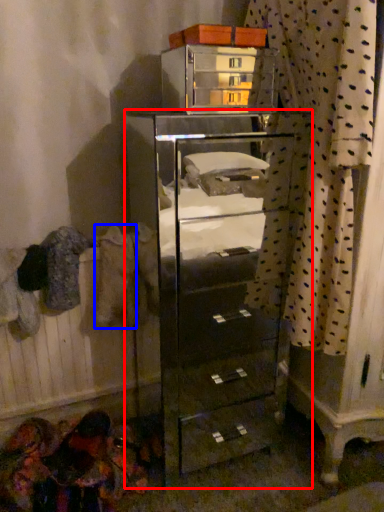
Question: Which of the following is the closest to the observer, chest of drawers (highlighted by a red box) or clothing (highlighted by a blue box)?

Choices:
 (A) chest of drawers
 (B) clothing

Answer: (A)